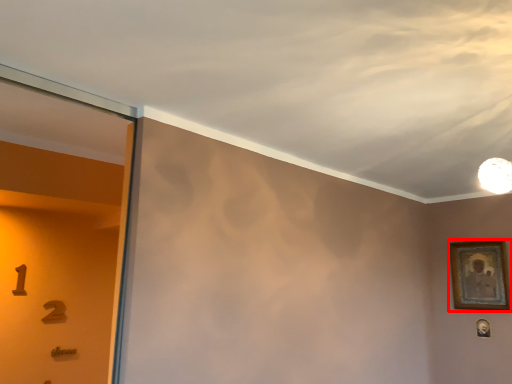
Question: From the image's perspective, what is the correct spatial relationship of picture frame (annotated by the red box) in relation to picture frame?

Choices:
 (A) below
 (B) above

Answer: (B)